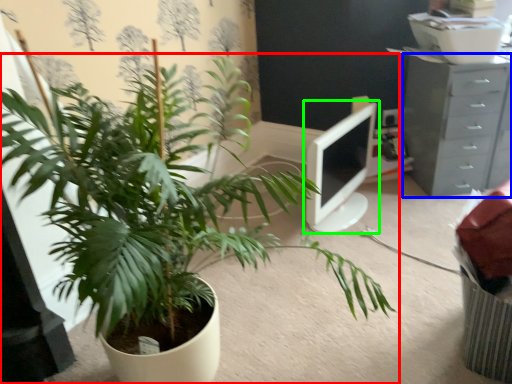
Question: Which object is positioned farthest from houseplant (highlighted by a red box)? Select from chest of drawers (highlighted by a blue box) and computer monitor (highlighted by a green box).

Choices:
 (A) chest of drawers
 (B) computer monitor

Answer: (A)